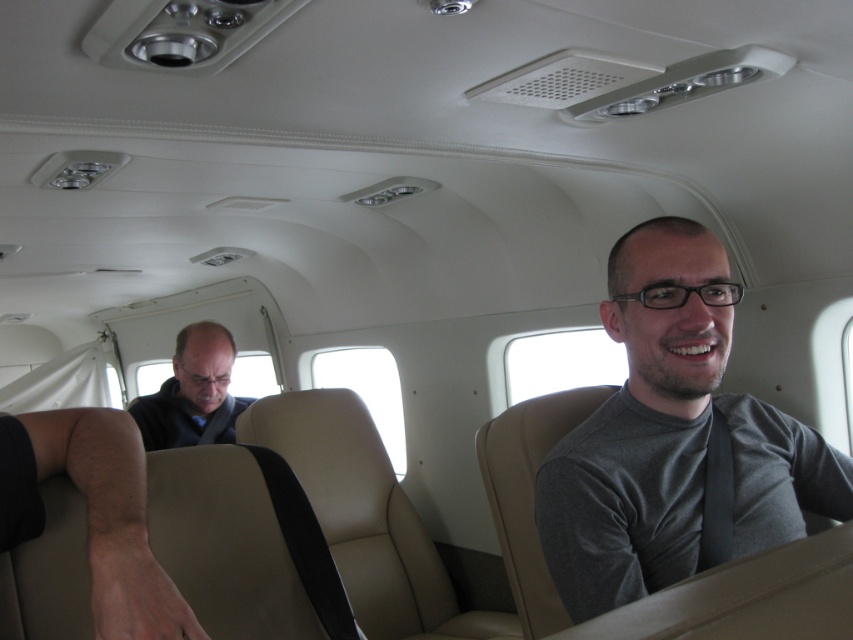
How far apart are gray matte shirt at center and dark brown leather jacket at left?

gray matte shirt at center is 1.84 meters away from dark brown leather jacket at left.

Between gray matte shirt at center and dark brown leather jacket at left, which one is positioned lower?

Positioned lower is dark brown leather jacket at left.

The height and width of the screenshot is (640, 853). What do you see at coordinates (672, 436) in the screenshot?
I see `gray matte shirt at center` at bounding box center [672, 436].

The image size is (853, 640). What are the coordinates of `gray matte shirt at center` in the screenshot? It's located at (672, 436).